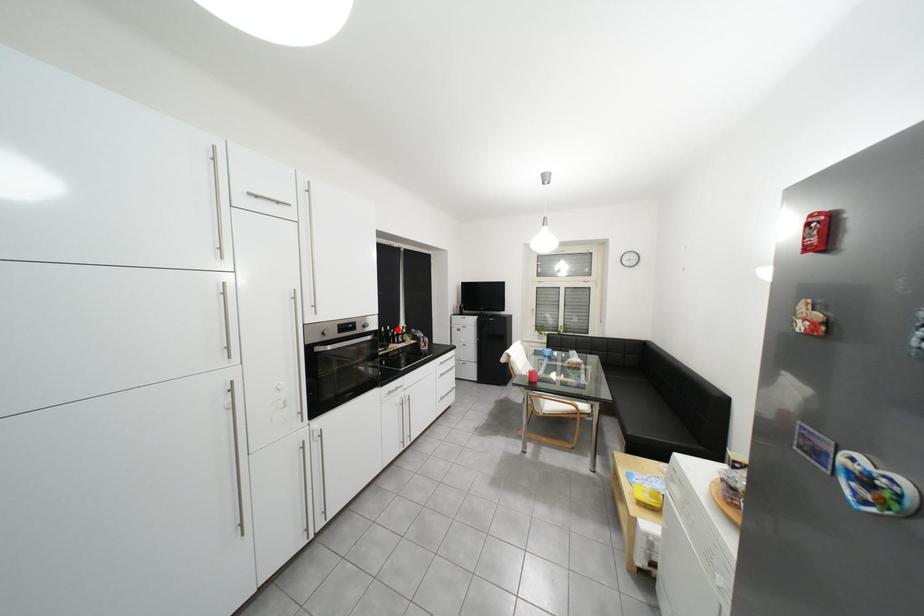
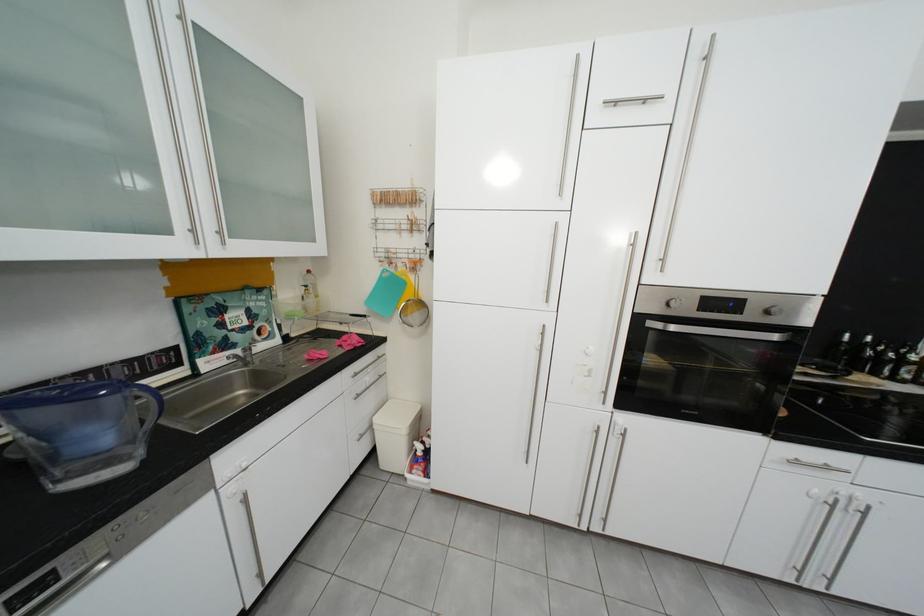
The point at the highlighted location is marked in the first image. Where is the corresponding point in the second image?

(869, 339)